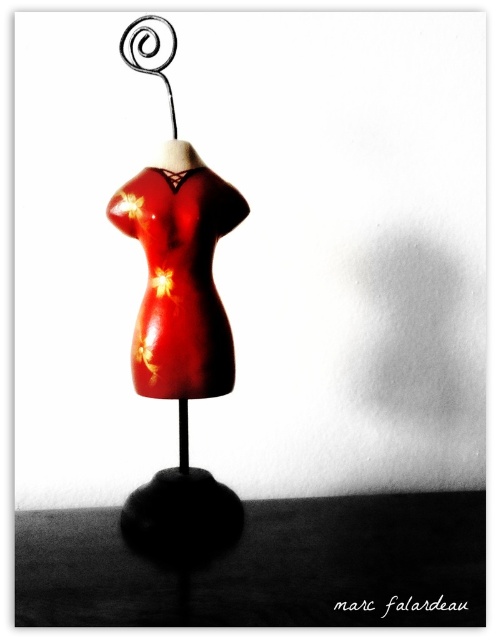
You are a store employee arranging items in a boutique. You need to place a price tag on the item that is smaller between the glossy red dress at center and the spiral wire hanger at upper center. Which item should you place the price tag on?

The spiral wire hanger at upper center is smaller than the glossy red dress at center, so you should place the price tag on the spiral wire hanger at upper center.

You are a store employee who needs to hang a new dress on the spiral wire hanger at upper center. The dress you have is exactly the same size as the glossy red dress at center. Can you safely place the new dress on the hanger without it touching the existing dress?

The glossy red dress at center and spiral wire hanger at upper center are 5.59 inches apart. Since the new dress is the same size as the existing one, there should be enough space between them to hang it safely without touching.